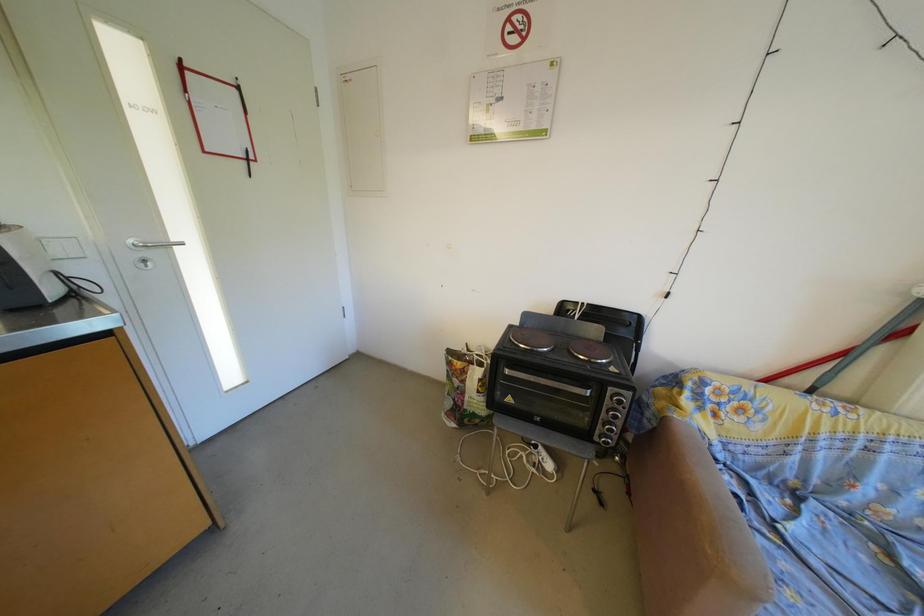
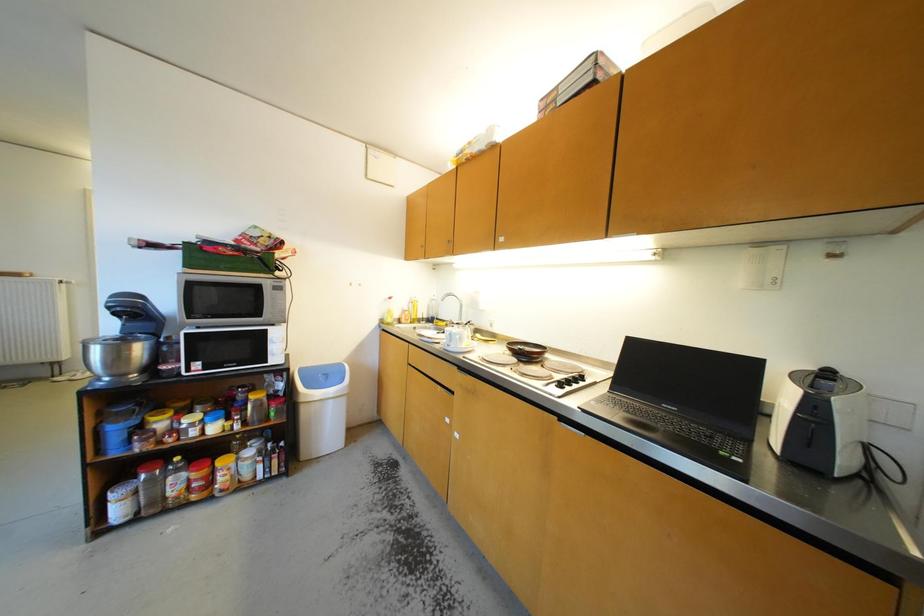
Question: The camera is either moving clockwise (left) or counter-clockwise (right) around the object. The first image is from the beginning of the video and the second image is from the end. Is the camera moving left or right when shooting the video?

Choices:
 (A) Left
 (B) Right

Answer: (B)